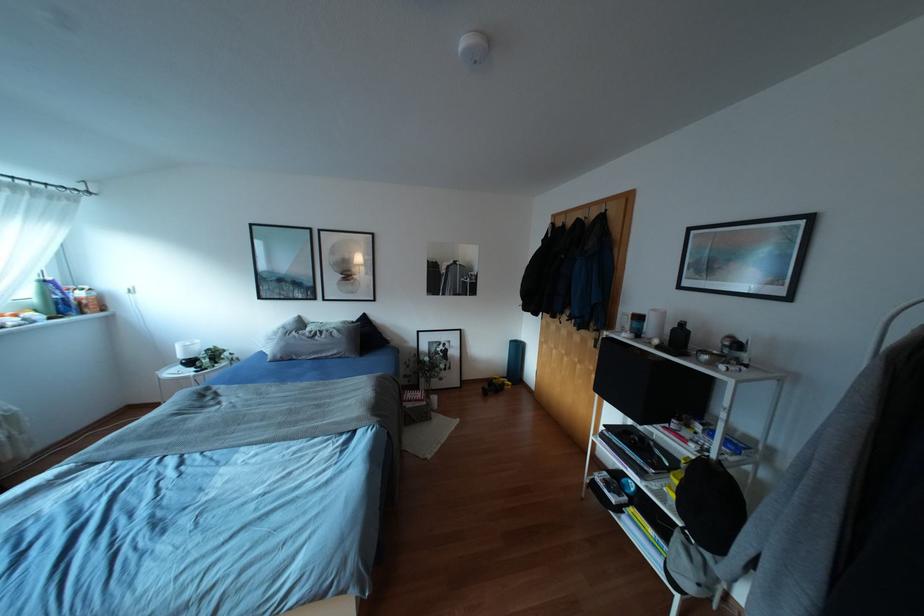
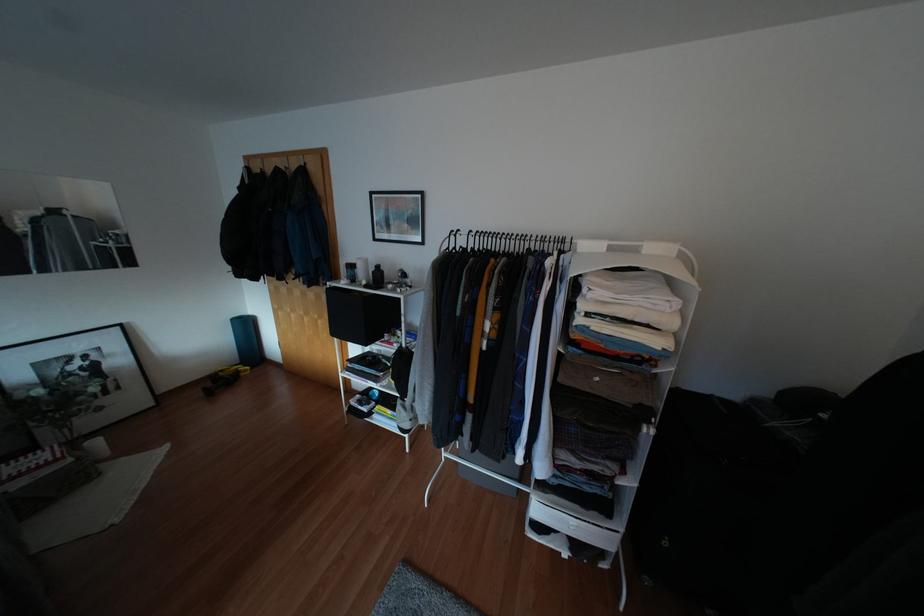
Where in the second image is the point corresponding to [655,341] from the first image?

(362, 282)